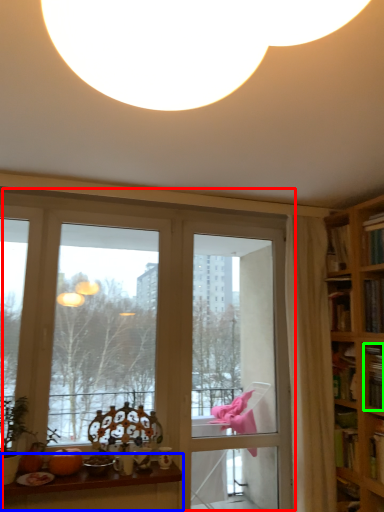
Question: Which object is the closest to the window (highlighted by a red box)? Choose among these: table (highlighted by a blue box) or book (highlighted by a green box).

Choices:
 (A) table
 (B) book

Answer: (A)